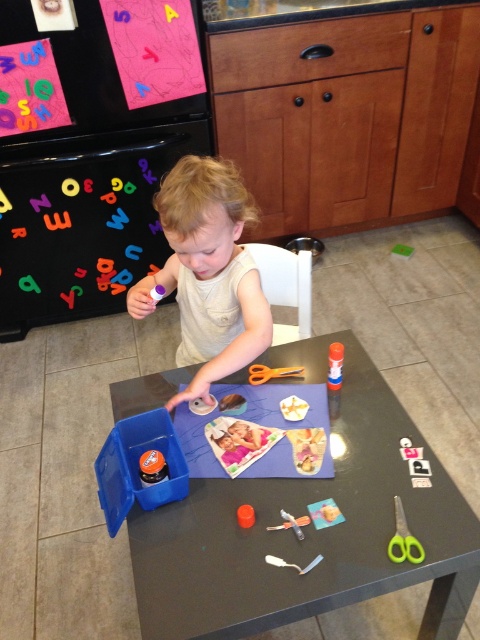
Consider the image. You are a parent observing your child at the table. You need to hand them the orange plastic scissors at table without touching the smooth beige shirt at center. Is this possible?

Yes, because the smooth beige shirt at center is above the orange plastic scissors at table, so you can reach the scissors underneath the shirt.

You are a parent trying to organize the craft area. The matte plastic table at center has limited space. If you want to move the metallic silver scissors at center to a drawer behind the table, will the scissors be behind the table after moving?

The matte plastic table at center is in front of metallic silver scissors at center, so moving the scissors to a drawer behind the table will place them behind the table.

You are planning to place a new decorative item on the matte plastic table at center. Based on its current position, which area of the table would be most appropriate to place the item without obstructing the child?

The matte plastic table at center is located at point (309,529), so placing the decorative item in an area that does not interfere with the existing crafting materials and the child would be best. Since the table is at that coordinate, ensure the item is placed in a clear space away from the scissors, glue, and paper.